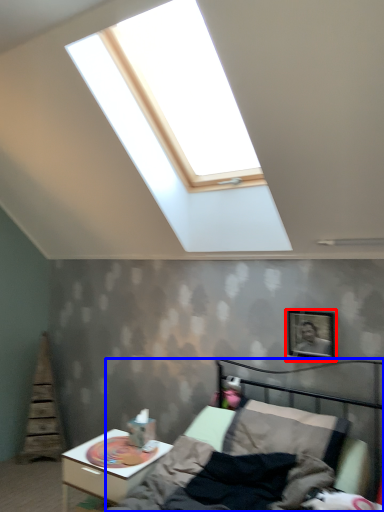
Question: Which object appears farthest to the camera in this image, picture frame (highlighted by a red box) or bed (highlighted by a blue box)?

Choices:
 (A) picture frame
 (B) bed

Answer: (A)